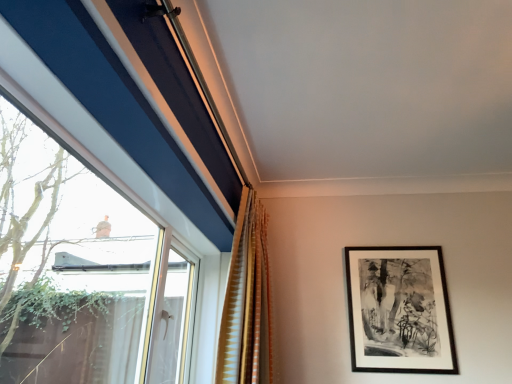
Question: Is gold textured curtain at center outside black matte picture frame at upper right?

Choices:
 (A) no
 (B) yes

Answer: (B)

Question: Considering the relative sizes of gold textured curtain at center and black matte picture frame at upper right in the image provided, is gold textured curtain at center wider than black matte picture frame at upper right?

Choices:
 (A) yes
 (B) no

Answer: (A)

Question: From a real-world perspective, is gold textured curtain at center located higher than black matte picture frame at upper right?

Choices:
 (A) yes
 (B) no

Answer: (A)

Question: Does gold textured curtain at center come in front of black matte picture frame at upper right?

Choices:
 (A) no
 (B) yes

Answer: (B)

Question: Does gold textured curtain at center touch black matte picture frame at upper right?

Choices:
 (A) yes
 (B) no

Answer: (B)

Question: From a real-world perspective, is gold textured curtain at center positioned under black matte picture frame at upper right based on gravity?

Choices:
 (A) yes
 (B) no

Answer: (B)

Question: Is black matte picture frame at upper right thinner than gold textured curtain at center?

Choices:
 (A) no
 (B) yes

Answer: (B)

Question: Does black matte picture frame at upper right touch gold textured curtain at center?

Choices:
 (A) no
 (B) yes

Answer: (A)

Question: Considering the relative sizes of black matte picture frame at upper right and gold textured curtain at center in the image provided, is black matte picture frame at upper right smaller than gold textured curtain at center?

Choices:
 (A) no
 (B) yes

Answer: (B)

Question: Does black matte picture frame at upper right have a greater height compared to gold textured curtain at center?

Choices:
 (A) no
 (B) yes

Answer: (A)

Question: Does black matte picture frame at upper right turn towards gold textured curtain at center?

Choices:
 (A) yes
 (B) no

Answer: (B)

Question: Is black matte picture frame at upper right to the right of gold textured curtain at center from the viewer's perspective?

Choices:
 (A) no
 (B) yes

Answer: (B)

Question: Considering the positions of gold textured curtain at center and black matte picture frame at upper right in the image, is gold textured curtain at center bigger or smaller than black matte picture frame at upper right?

Choices:
 (A) big
 (B) small

Answer: (A)